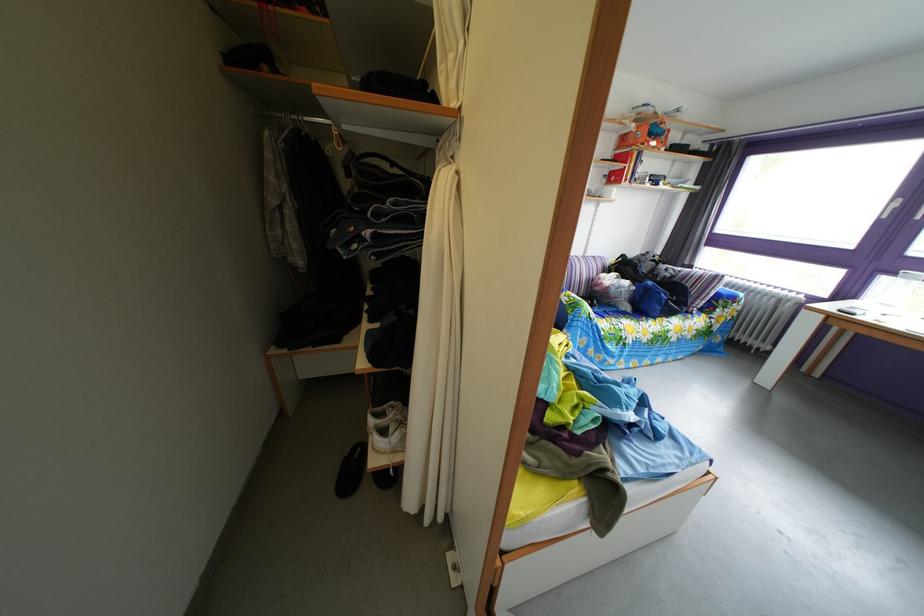
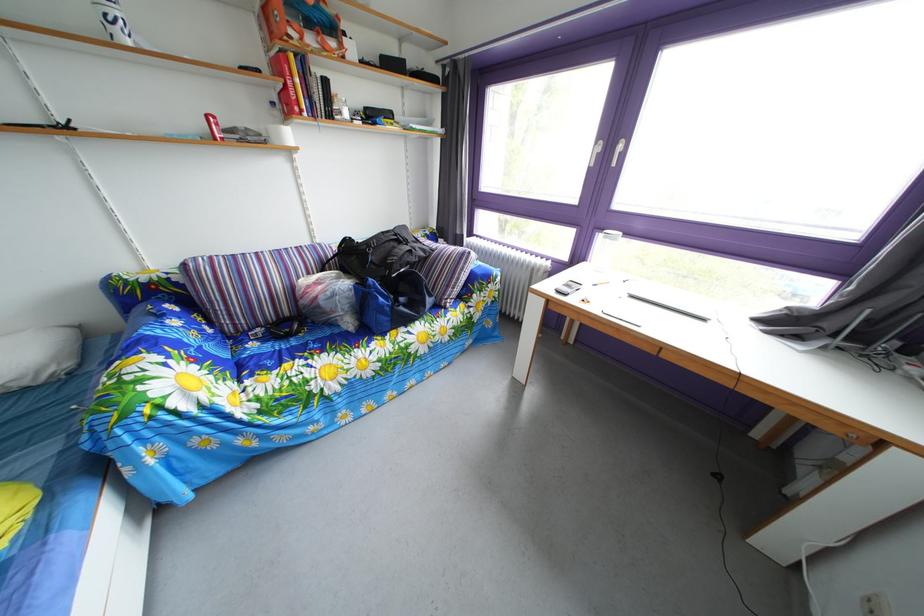
The point at (661, 144) is marked in the first image. Where is the corresponding point in the second image?

(320, 33)